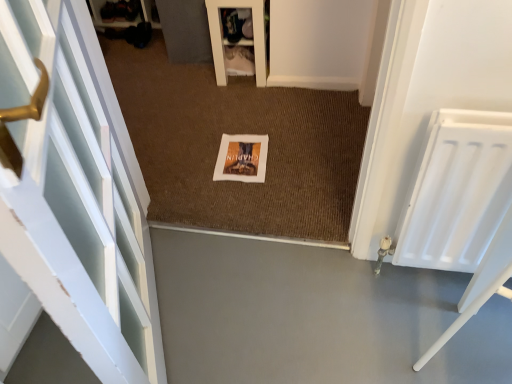
Find the location of `vacant area that is in front of white fabric shoe rack at upper center`. vacant area that is in front of white fabric shoe rack at upper center is located at coordinates (236, 92).